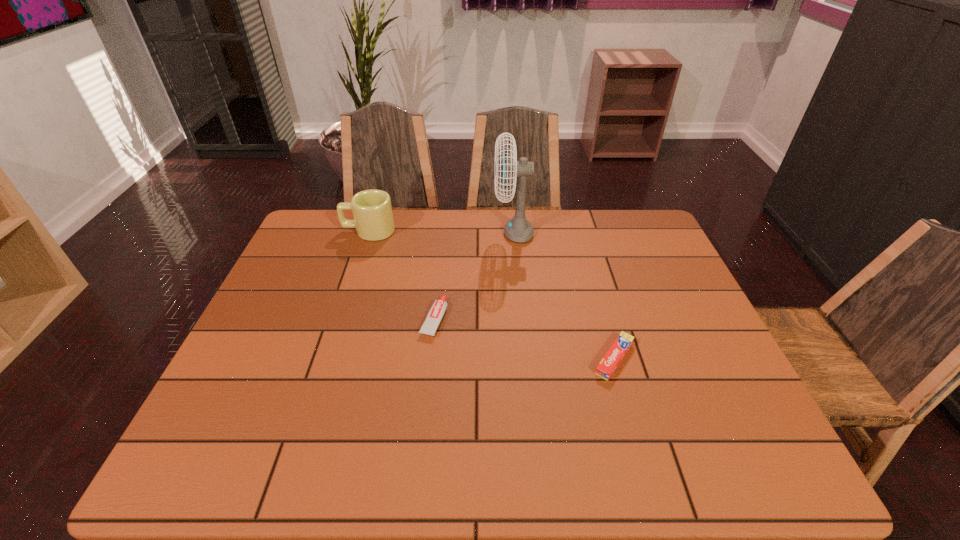
This screenshot has height=540, width=960. Identify the location of vacant area at the right edge. (661, 270).

At what (x,y) coordinates should I click in order to perform the action: click on vacant space at the far left corner of the desktop. Please return your answer as a coordinate pair (x, y). This screenshot has height=540, width=960. Looking at the image, I should click on (336, 216).

Image resolution: width=960 pixels, height=540 pixels. In the image, there is a desktop. What are the coordinates of `vacant space at the near left corner` in the screenshot? It's located at (231, 448).

In the image, there is a desktop. Where is `vacant area at the far right corner`? The width and height of the screenshot is (960, 540). vacant area at the far right corner is located at coordinates (647, 231).

You are a GUI agent. You are given a task and a screenshot of the screen. Output one action in this format:
    pyautogui.click(x=<x>, y=<y>)
    Task: Click on the free space at the near right corner
    The height and width of the screenshot is (540, 960).
    Given the screenshot: What is the action you would take?
    pyautogui.click(x=732, y=446)

Locate an element on the screen. The width and height of the screenshot is (960, 540). empty space that is in between the left toothpaste and the shortest object is located at coordinates (524, 339).

At what (x,y) coordinates should I click in order to perform the action: click on unoccupied position between the right toothpaste and the tallest object. Please return your answer as a coordinate pair (x, y). Image resolution: width=960 pixels, height=540 pixels. Looking at the image, I should click on (564, 295).

At what (x,y) coordinates should I click in order to perform the action: click on vacant space in between the rightmost object and the second object from right to left. Please return your answer as a coordinate pair (x, y). This screenshot has height=540, width=960. Looking at the image, I should click on (564, 295).

The image size is (960, 540). I want to click on vacant space that is in between the leftmost object and the left toothpaste, so click(401, 275).

You are a GUI agent. You are given a task and a screenshot of the screen. Output one action in this format:
    pyautogui.click(x=<x>, y=<y>)
    Task: Click on the free point between the left toothpaste and the leftmost object
    
    Given the screenshot: What is the action you would take?
    pyautogui.click(x=401, y=275)